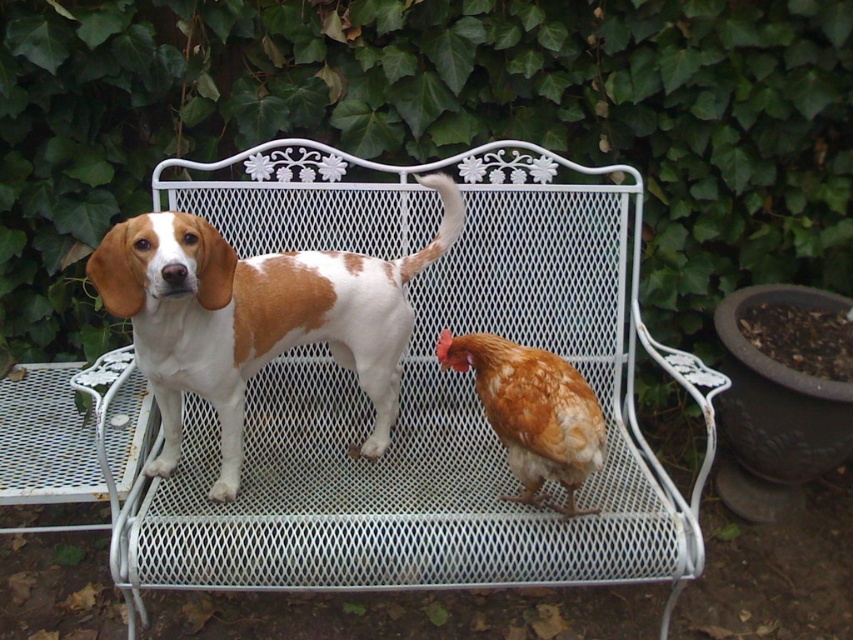
Looking at this image, you are a photographer wanting to capture the brown and white fur dog at center and the white metal bench at center in a single shot. Since the bench is taller than the dog, how should you adjust your camera angle to ensure both subjects are fully visible in the frame?

Since the white metal bench at center is taller than the brown and white fur dog at center, you should position your camera slightly lower to capture the entire height of the bench while still including the dog in the foreground.

You are a photographer wanting to capture the brown and white fur dog at center and the brown feathered chicken at center in a single frame. Based on their positions, which animal should you focus on first if you start from the left side of the bench?

The brown and white fur dog at center is to the left of the brown feathered chicken at center, so you should focus on the brown and white fur dog at center first when starting from the left side of the bench.